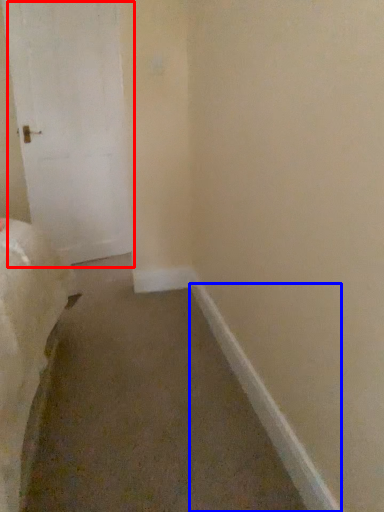
Question: Which object is further to the camera taking this photo, door (highlighted by a red box) or molding (highlighted by a blue box)?

Choices:
 (A) door
 (B) molding

Answer: (A)